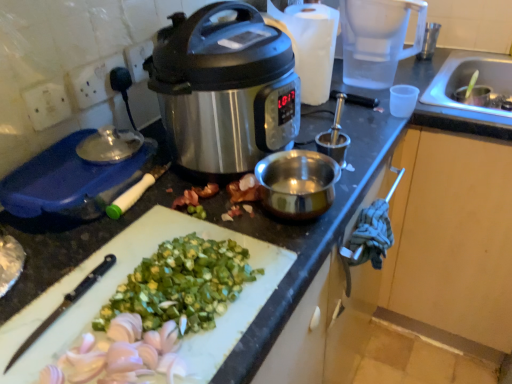
Question: From the image's perspective, is blue plastic container at left on top of metallic silver cup at upper right?

Choices:
 (A) no
 (B) yes

Answer: (A)

Question: Does blue plastic container at left lie behind metallic silver cup at upper right?

Choices:
 (A) yes
 (B) no

Answer: (B)

Question: Is blue plastic container at left looking in the opposite direction of metallic silver cup at upper right?

Choices:
 (A) yes
 (B) no

Answer: (B)

Question: Is blue plastic container at left thinner than metallic silver cup at upper right?

Choices:
 (A) yes
 (B) no

Answer: (B)

Question: From the image's perspective, is blue plastic container at left beneath metallic silver cup at upper right?

Choices:
 (A) yes
 (B) no

Answer: (A)

Question: Is stainless steel slow cooker at center wider or thinner than transparent plastic blender at upper right?

Choices:
 (A) wide
 (B) thin

Answer: (A)

Question: From a real-world perspective, is stainless steel slow cooker at center above or below transparent plastic blender at upper right?

Choices:
 (A) above
 (B) below

Answer: (A)

Question: Is stainless steel slow cooker at center inside or outside of transparent plastic blender at upper right?

Choices:
 (A) outside
 (B) inside

Answer: (A)

Question: From the image's perspective, is stainless steel slow cooker at center positioned above or below transparent plastic blender at upper right?

Choices:
 (A) above
 (B) below

Answer: (B)

Question: Is point (282, 104) positioned closer to the camera than point (201, 213)?

Choices:
 (A) closer
 (B) farther

Answer: (A)

Question: Is stainless steel slow cooker at center taller or shorter than green matte okra at center?

Choices:
 (A) short
 (B) tall

Answer: (B)

Question: From the image's perspective, is stainless steel slow cooker at center located above or below green matte okra at center?

Choices:
 (A) below
 (B) above

Answer: (B)

Question: Is stainless steel slow cooker at center in front of or behind green matte okra at center in the image?

Choices:
 (A) front
 (B) behind

Answer: (A)

Question: Would you say green matte okra at center is inside or outside white plastic cutting board at lower center?

Choices:
 (A) outside
 (B) inside

Answer: (A)

Question: From their relative heights in the image, would you say green matte okra at center is taller or shorter than white plastic cutting board at lower center?

Choices:
 (A) short
 (B) tall

Answer: (A)